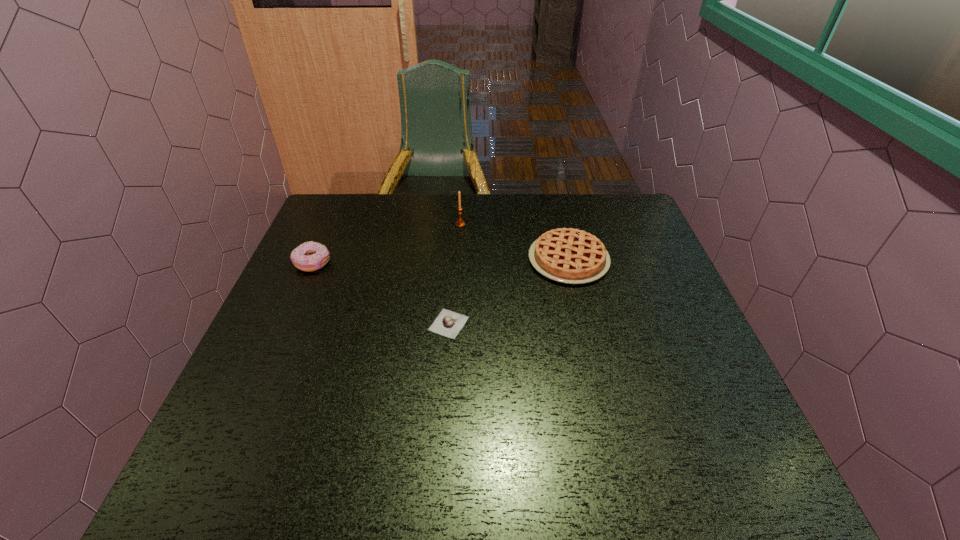
I want to click on blank region between the tallest object and the nearest object, so click(455, 274).

Identify the location of free space between the tallest object and the leftmost object. The width and height of the screenshot is (960, 540). (387, 244).

Choose which object is the second nearest neighbor to the doughnut. Please provide its 2D coordinates. Your answer should be formatted as a tuple, i.e. [(x, y)], where the tuple contains the x and y coordinates of a point satisfying the conditions above.

[(460, 223)]

Where is `the closest object to the garlic`? The width and height of the screenshot is (960, 540). the closest object to the garlic is located at coordinates (567, 255).

Where is `vacant space that satisfies the following two spatial constraints: 1. on the front side of the farthest object; 2. on the right side of the second shortest object`? vacant space that satisfies the following two spatial constraints: 1. on the front side of the farthest object; 2. on the right side of the second shortest object is located at coordinates (458, 260).

The height and width of the screenshot is (540, 960). Find the location of `free space that satisfies the following two spatial constraints: 1. on the front side of the leftmost object; 2. on the left side of the nearest object`. free space that satisfies the following two spatial constraints: 1. on the front side of the leftmost object; 2. on the left side of the nearest object is located at coordinates (286, 324).

The width and height of the screenshot is (960, 540). I want to click on free space in the image that satisfies the following two spatial constraints: 1. on the front side of the doughnut; 2. on the right side of the shortest object, so click(286, 324).